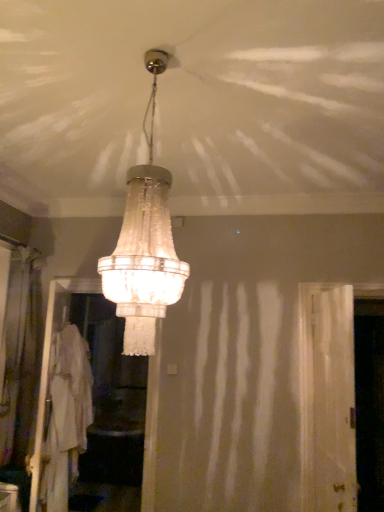
Question: Considering the relative sizes of white translucent screen door at right, marked as the 1th screen door in a front-to-back arrangement, and clear plastic screen door at right, which ranks as the 1th screen door in right-to-left order, in the image provided, is white translucent screen door at right, marked as the 1th screen door in a front-to-back arrangement, shorter than clear plastic screen door at right, which ranks as the 1th screen door in right-to-left order,?

Choices:
 (A) yes
 (B) no

Answer: (A)

Question: Can you confirm if white translucent screen door at right, marked as the 1th screen door in a front-to-back arrangement, is wider than clear plastic screen door at right, which ranks as the 1th screen door in right-to-left order?

Choices:
 (A) yes
 (B) no

Answer: (B)

Question: Does white translucent screen door at right, the 2th screen door viewed from the left, come behind clear plastic screen door at right, the first screen door in the back-to-front sequence?

Choices:
 (A) yes
 (B) no

Answer: (B)

Question: Is white translucent screen door at right, the 2th screen door viewed from the left, not within clear plastic screen door at right, which is counted as the third screen door, starting from the left?

Choices:
 (A) no
 (B) yes

Answer: (B)

Question: Can you confirm if white translucent screen door at right, the third screen door from the back, is taller than clear plastic screen door at right, the 3th screen door when ordered from front to back?

Choices:
 (A) no
 (B) yes

Answer: (A)

Question: Is white translucent screen door at right, the 2th screen door viewed from the left, placed right next to clear plastic screen door at right, which is counted as the third screen door, starting from the left?

Choices:
 (A) yes
 (B) no

Answer: (B)

Question: Is clear plastic screen door at right, which ranks as the 1th screen door in right-to-left order, thinner than white translucent screen door at center, which ranks as the third screen door in right-to-left order?

Choices:
 (A) yes
 (B) no

Answer: (A)

Question: Does clear plastic screen door at right, which is counted as the third screen door, starting from the left, have a larger size compared to white translucent screen door at center, arranged as the first screen door when viewed from the left?

Choices:
 (A) no
 (B) yes

Answer: (A)

Question: From a real-world perspective, is clear plastic screen door at right, the 3th screen door when ordered from front to back, located beneath white translucent screen door at center, which ranks as the third screen door in right-to-left order?

Choices:
 (A) yes
 (B) no

Answer: (A)

Question: Is clear plastic screen door at right, the 3th screen door when ordered from front to back, with white translucent screen door at center, which ranks as the third screen door in right-to-left order?

Choices:
 (A) no
 (B) yes

Answer: (A)

Question: From the image's perspective, is clear plastic screen door at right, the 3th screen door when ordered from front to back, above white translucent screen door at center, which appears as the second screen door when viewed from the back?

Choices:
 (A) no
 (B) yes

Answer: (A)

Question: Is clear plastic screen door at right, the 3th screen door when ordered from front to back, outside white translucent screen door at center, arranged as the first screen door when viewed from the left?

Choices:
 (A) no
 (B) yes

Answer: (B)

Question: Is silky beige curtain at left smaller than white translucent screen door at right, the third screen door from the back?

Choices:
 (A) no
 (B) yes

Answer: (A)